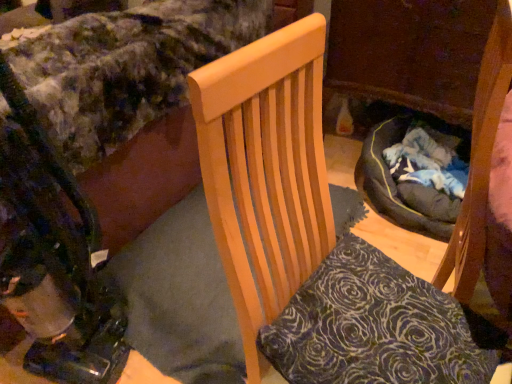
Question: From a real-world perspective, is velvety dark blue pillow at center under metallic black baby carriage at lower left?

Choices:
 (A) yes
 (B) no

Answer: (A)

Question: Are velvety dark blue pillow at center and metallic black baby carriage at lower left making contact?

Choices:
 (A) no
 (B) yes

Answer: (A)

Question: Considering the relative sizes of velvety dark blue pillow at center and metallic black baby carriage at lower left in the image provided, is velvety dark blue pillow at center smaller than metallic black baby carriage at lower left?

Choices:
 (A) yes
 (B) no

Answer: (A)

Question: Is velvety dark blue pillow at center to the right of metallic black baby carriage at lower left from the viewer's perspective?

Choices:
 (A) yes
 (B) no

Answer: (A)

Question: Is the depth of velvety dark blue pillow at center less than that of metallic black baby carriage at lower left?

Choices:
 (A) no
 (B) yes

Answer: (A)

Question: Considering the relative sizes of velvety dark blue pillow at center and metallic black baby carriage at lower left in the image provided, is velvety dark blue pillow at center wider than metallic black baby carriage at lower left?

Choices:
 (A) yes
 (B) no

Answer: (A)

Question: Is metallic black baby carriage at lower left not close to velvety floral bedspread at upper left?

Choices:
 (A) yes
 (B) no

Answer: (B)

Question: From the image's perspective, is metallic black baby carriage at lower left below velvety floral bedspread at upper left?

Choices:
 (A) no
 (B) yes

Answer: (B)

Question: Considering the relative sizes of metallic black baby carriage at lower left and velvety floral bedspread at upper left in the image provided, is metallic black baby carriage at lower left wider than velvety floral bedspread at upper left?

Choices:
 (A) yes
 (B) no

Answer: (B)

Question: From a real-world perspective, is metallic black baby carriage at lower left beneath velvety floral bedspread at upper left?

Choices:
 (A) yes
 (B) no

Answer: (B)

Question: Could velvety floral bedspread at upper left be considered to be inside metallic black baby carriage at lower left?

Choices:
 (A) yes
 (B) no

Answer: (B)

Question: Is metallic black baby carriage at lower left taller than velvety floral bedspread at upper left?

Choices:
 (A) no
 (B) yes

Answer: (B)

Question: Is velvety floral bedspread at upper left taller than wooden chair at center?

Choices:
 (A) yes
 (B) no

Answer: (B)